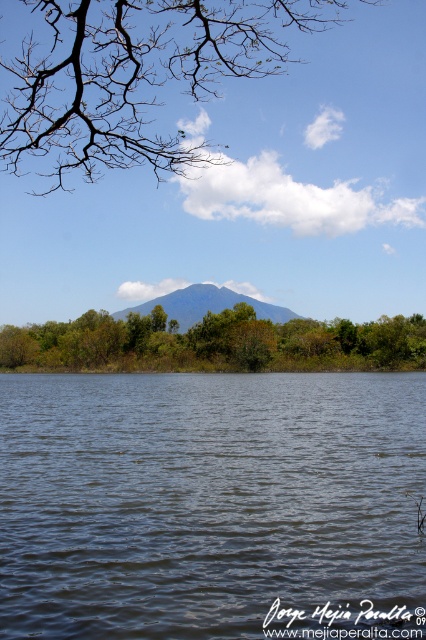
Looking at this image, you are standing at the base of the mountain in the image. There is a point marked at coordinates (135, 76). What is located at this point?

The point at coordinates (135, 76) is where the bare branches at upper center are located.

You are a hiker trying to cross the transparent water at center. There are green leafy trees at center nearby. Which direction should you go to avoid getting your shoes wet?

The transparent water at center is located below green leafy trees at center, so to avoid getting your shoes wet, you should go above the green leafy trees at center.